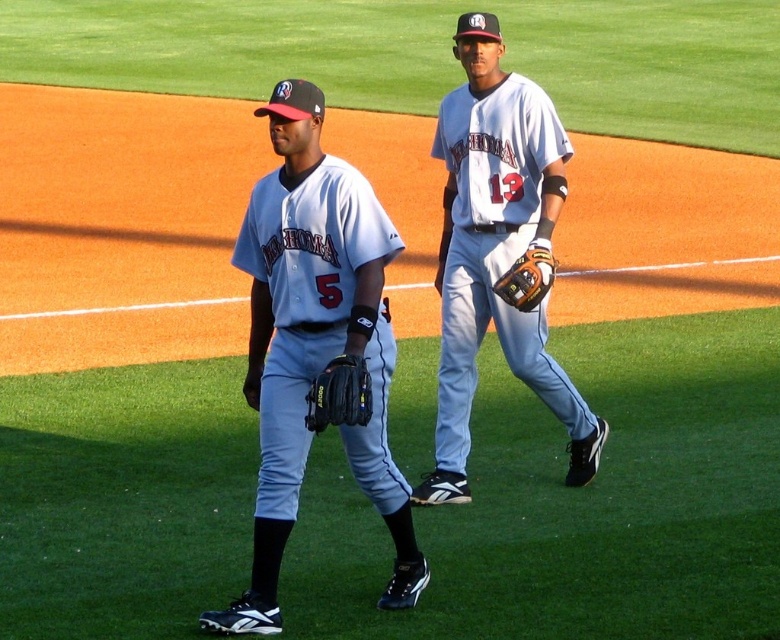
Which is behind, point (232, 259) or point (516, 308)?

Point (516, 308)

Consider the image. Is matte gray uniform at center in front of brown leather glove at center?

Yes, it is.

Who is more forward, (339, 244) or (526, 248)?

Point (339, 244) is in front.

Where is `matte gray uniform at center`? The height and width of the screenshot is (640, 780). matte gray uniform at center is located at coordinates (314, 342).

Who is more distant from viewer, (x=481, y=60) or (x=518, y=273)?

Positioned behind is point (x=481, y=60).

Can you confirm if white matte baseball glove at center is thinner than brown leather glove at center?

No.

Image resolution: width=780 pixels, height=640 pixels. Find the location of `white matte baseball glove at center`. white matte baseball glove at center is located at coordinates (495, 252).

I want to click on white matte baseball glove at center, so click(495, 252).

Is black leather baseball glove at lower center thinner than brown leather glove at center?

Yes.

Between black leather baseball glove at lower center and brown leather glove at center, which one is positioned higher?

brown leather glove at center is higher up.

Is point (346, 376) positioned after point (505, 296)?

That is False.

Locate an element on the screen. This screenshot has height=640, width=780. black leather baseball glove at lower center is located at coordinates (339, 394).